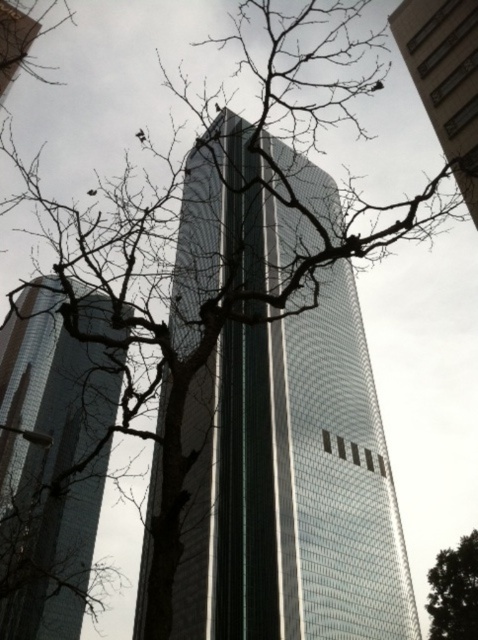
Question: Is shiny glass tower at left to the right of glassy reflective skyscraper at upper center from the viewer's perspective?

Choices:
 (A) yes
 (B) no

Answer: (B)

Question: Based on their relative distances, which object is farther from the green leafy tree at center?

Choices:
 (A) glassy reflective skyscraper at upper center
 (B) shiny glass tower at left
 (C) glassy reflective skyscraper at center

Answer: (B)

Question: Is shiny glass tower at left smaller than glassy reflective skyscraper at upper center?

Choices:
 (A) no
 (B) yes

Answer: (A)

Question: Is glassy reflective skyscraper at center closer to camera compared to green leafy tree at center?

Choices:
 (A) no
 (B) yes

Answer: (B)

Question: Among these points, which one is nearest to the camera?

Choices:
 (A) (289, 493)
 (B) (453, 570)
 (C) (468, 65)

Answer: (C)

Question: Which object appears closest to the camera in this image?

Choices:
 (A) glassy reflective skyscraper at center
 (B) glassy reflective skyscraper at upper center
 (C) green leafy tree at center

Answer: (A)